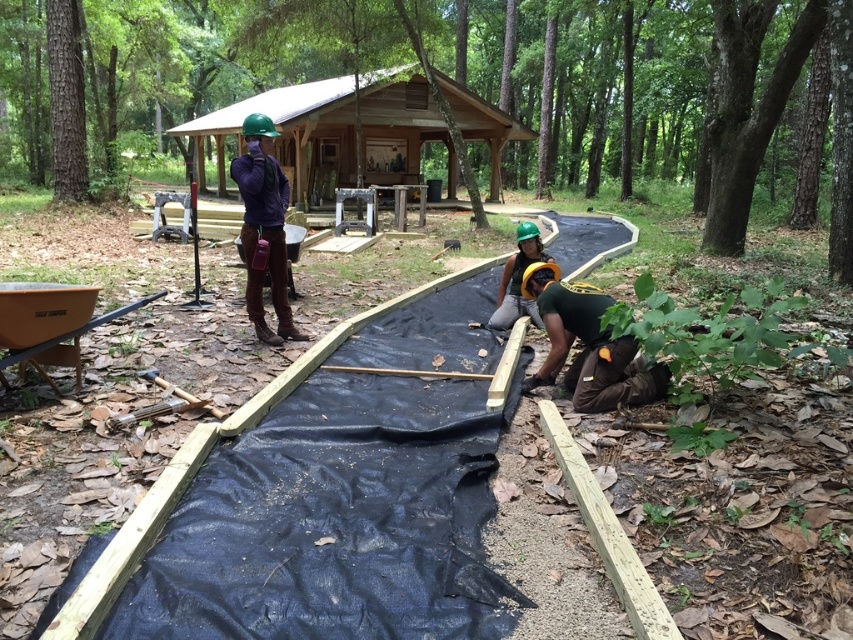
Is green matte helmet at lower right taller than matte purple shirt at upper center?

No, green matte helmet at lower right is not taller than matte purple shirt at upper center.

Is point (610, 340) farther from camera compared to point (252, 237)?

No.

Which is in front, point (556, 282) or point (276, 179)?

Point (556, 282) is in front.

Identify the location of green matte helmet at lower right. (589, 346).

Is matte purple shirt at upper center taller than green matte helmet at center?

Indeed, matte purple shirt at upper center has a greater height compared to green matte helmet at center.

Describe the element at coordinates (263, 227) in the screenshot. Image resolution: width=853 pixels, height=640 pixels. I see `matte purple shirt at upper center` at that location.

The image size is (853, 640). Describe the element at coordinates (263, 227) in the screenshot. I see `matte purple shirt at upper center` at that location.

Where is `matte purple shirt at upper center`? matte purple shirt at upper center is located at coordinates (263, 227).

Which is below, wooden cabin at upper center or green matte helmet at center?

green matte helmet at center is below.

The image size is (853, 640). What do you see at coordinates (341, 125) in the screenshot?
I see `wooden cabin at upper center` at bounding box center [341, 125].

You are a GUI agent. You are given a task and a screenshot of the screen. Output one action in this format:
    pyautogui.click(x=<x>, y=<y>)
    Task: Click on the wooden cabin at upper center
    This screenshot has height=640, width=853.
    Given the screenshot: What is the action you would take?
    pyautogui.click(x=341, y=125)